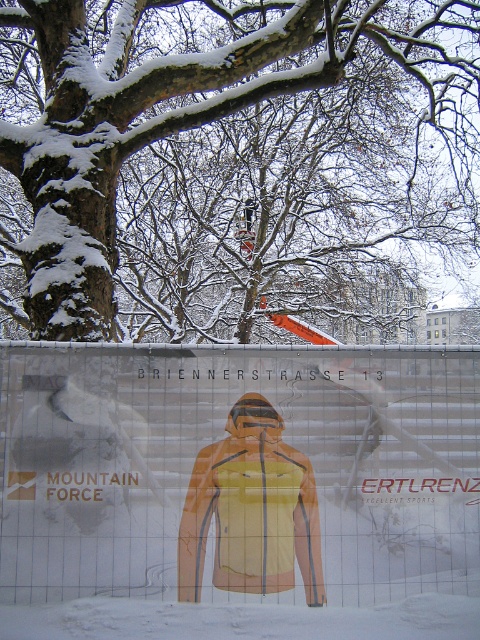
Who is more forward, (71,195) or (431,362)?

Point (431,362) is more forward.

Who is positioned more to the left, snow-covered bark at upper left or transparent plastic at center?

transparent plastic at center is more to the left.

Where is `snow-covered bark at upper left`? The width and height of the screenshot is (480, 640). snow-covered bark at upper left is located at coordinates (232, 163).

You are a GUI agent. You are given a task and a screenshot of the screen. Output one action in this format:
    pyautogui.click(x=<x>, y=<y>)
    Task: Click on the snow-covered bark at upper left
    
    Given the screenshot: What is the action you would take?
    pyautogui.click(x=232, y=163)